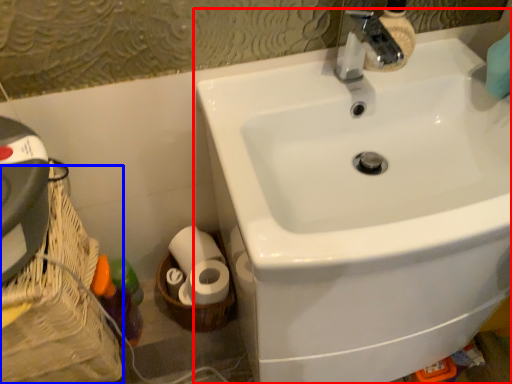
Question: Among these objects, which one is nearest to the camera, sink (highlighted by a red box) or basket container (highlighted by a blue box)?

Choices:
 (A) sink
 (B) basket container

Answer: (A)